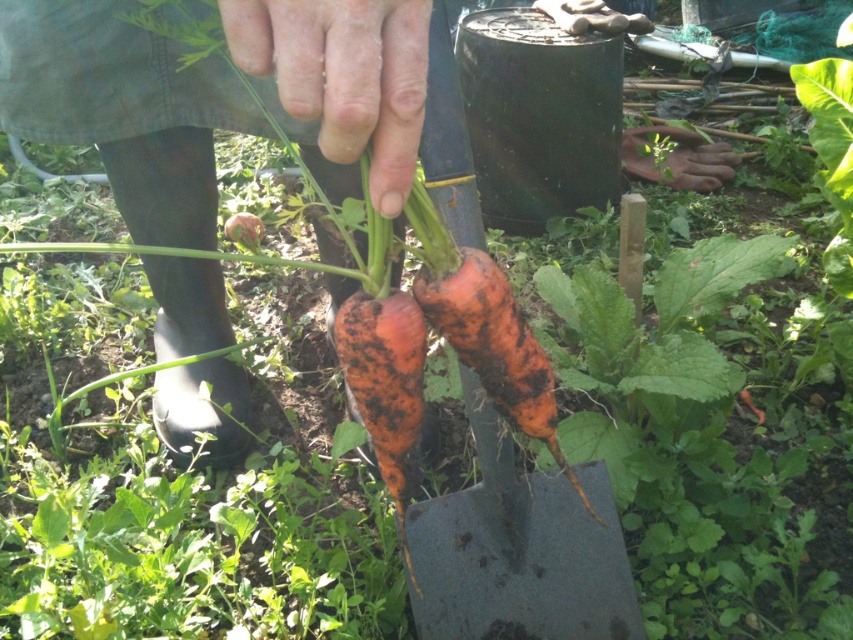
You are a farmer who just pulled out two carrots from the ground. You have the orange rough skin carrot at center and the orange rough carrot at center in your hands. Which carrot is taller?

The orange rough skin carrot at center is taller than the orange rough carrot at center.